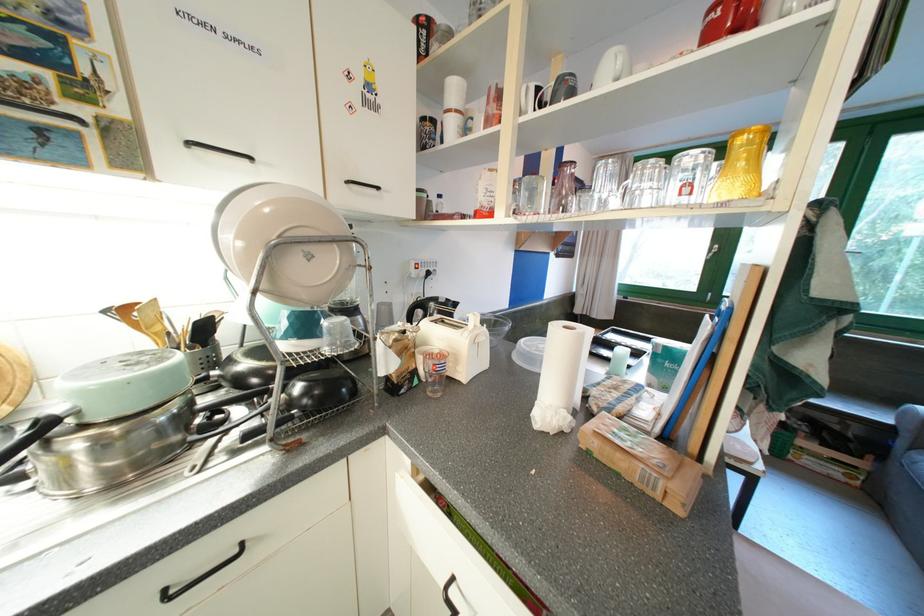
Where would you push the white toaster lever? Please return your answer as a coordinate pair (x, y).

(456, 342)